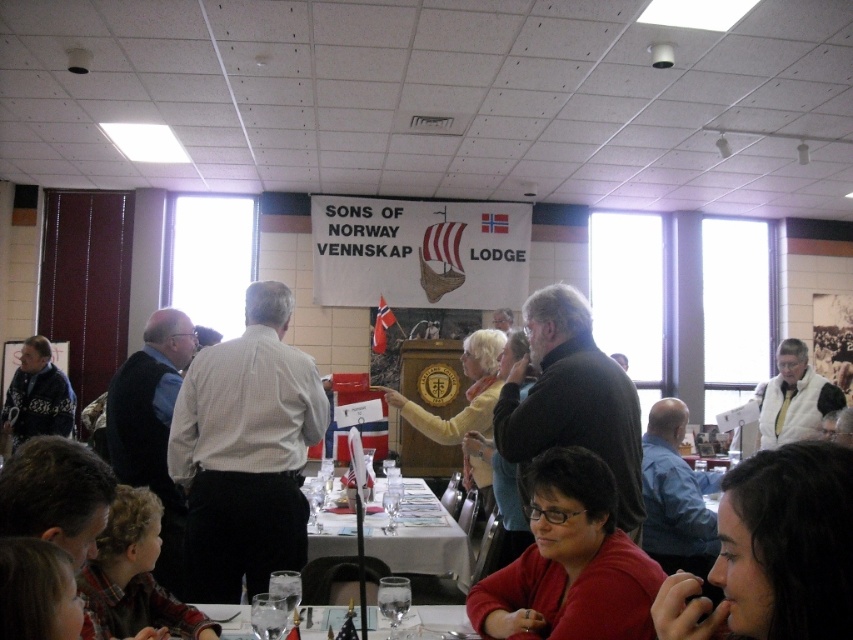
Which of these two, dark brown hair at lower right or blue shirt at right, stands shorter?

dark brown hair at lower right

Does point (723, 545) come closer to viewer compared to point (643, 548)?

Yes, point (723, 545) is in front of point (643, 548).

Locate an element on the screen. This screenshot has width=853, height=640. dark brown hair at lower right is located at coordinates (775, 552).

What do you see at coordinates (775, 552) in the screenshot?
I see `dark brown hair at lower right` at bounding box center [775, 552].

Is point (747, 564) positioned after point (604, 632)?

No, it is in front of (604, 632).

You are a GUI agent. You are given a task and a screenshot of the screen. Output one action in this format:
    pyautogui.click(x=<x>, y=<y>)
    Task: Click on the dark brown hair at lower right
    
    Given the screenshot: What is the action you would take?
    pyautogui.click(x=775, y=552)

Is matte red sweater at lower center closer to camera compared to knitted sweater at left?

Yes, it is.

Image resolution: width=853 pixels, height=640 pixels. I want to click on matte red sweater at lower center, so [569, 563].